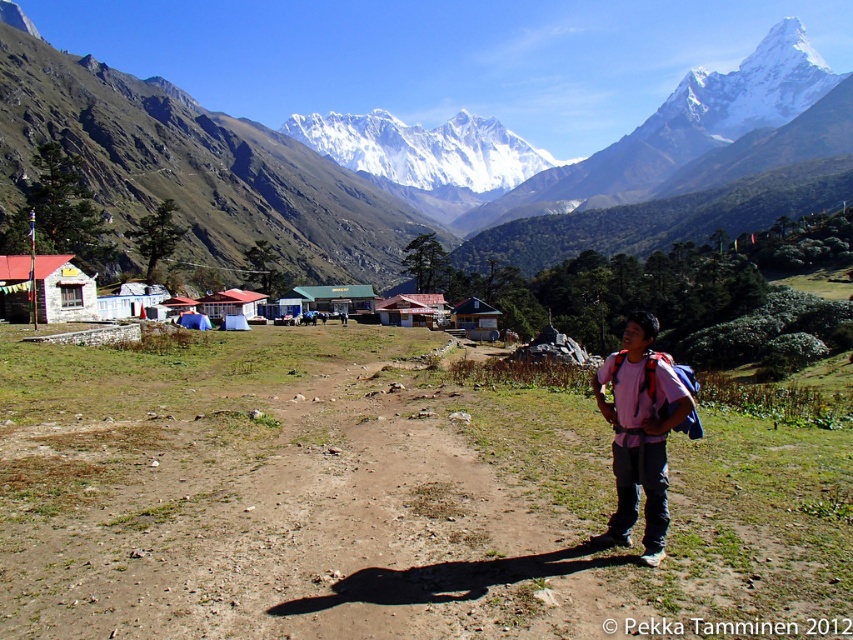
Between pink fabric backpack at center and brown wooden hut at center, which one has less height?

brown wooden hut at center is shorter.

Consider the image. Can you confirm if pink fabric backpack at center is positioned above brown wooden hut at center?

Actually, pink fabric backpack at center is below brown wooden hut at center.

Image resolution: width=853 pixels, height=640 pixels. I want to click on pink fabric backpack at center, so click(x=639, y=433).

Who is positioned more to the right, green corrugated metal hut at center or white corrugated metal hut at center?

green corrugated metal hut at center

Is green corrugated metal hut at center to the left of white corrugated metal hut at center from the viewer's perspective?

In fact, green corrugated metal hut at center is to the right of white corrugated metal hut at center.

What do you see at coordinates (335, 298) in the screenshot? I see `green corrugated metal hut at center` at bounding box center [335, 298].

Locate an element on the screen. green corrugated metal hut at center is located at coordinates (335, 298).

Is brown corrugated metal hut at center behind brown wooden hut at center?

Yes, it is behind brown wooden hut at center.

Is point (379, 308) positioned before point (463, 305)?

No, (379, 308) is further to viewer.

The height and width of the screenshot is (640, 853). What are the coordinates of `brown corrugated metal hut at center` in the screenshot? It's located at (412, 308).